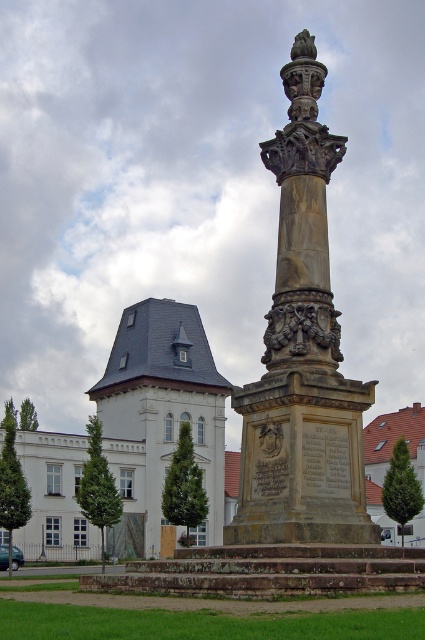
You are standing in the town square facing the monument. You notice two points marked on the ground. The first point is at coordinate point (345, 451) and the second is at point (212, 477). Which point is closer to you?

Point (345, 451) is in front of point (212, 477), so the first point is closer to you.